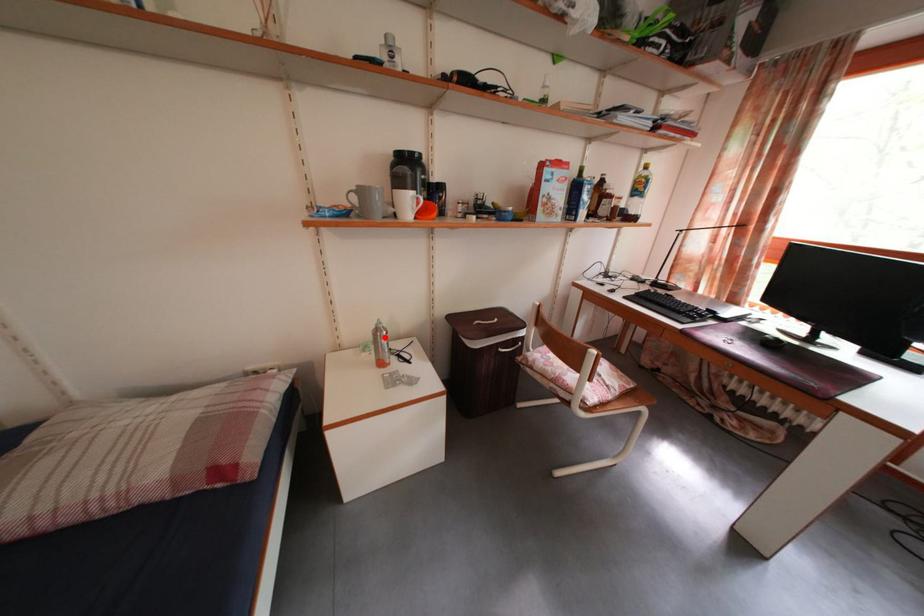
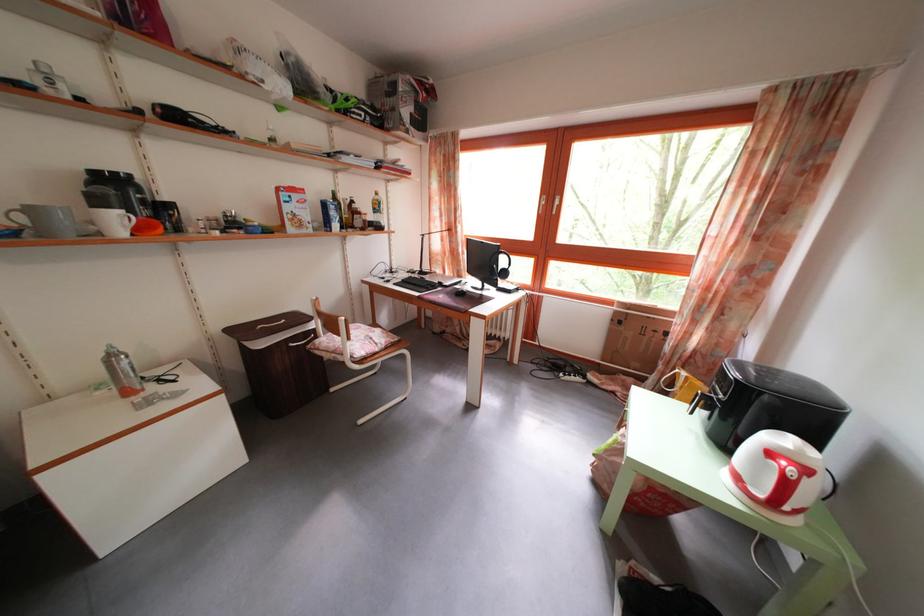
Question: A red point is marked in image1. In image2, is the corresponding 3D point closer to the camera or farther? Reply with the corresponding letter.

Choices:
 (A) The corresponding 3D point is closer.
 (B) The corresponding 3D point is farther.

Answer: (B)